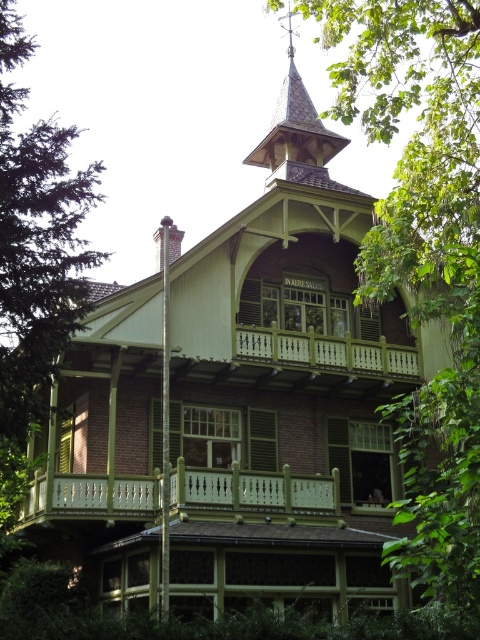
Consider the image. Between green leafy tree at upper center and green painted wood balustrade at center, which one is positioned higher?

Positioned higher is green leafy tree at upper center.

Between green leafy tree at upper center and green painted wood balustrade at center, which one appears on the right side from the viewer's perspective?

From the viewer's perspective, green leafy tree at upper center appears more on the right side.

Locate an element on the screen. Image resolution: width=480 pixels, height=640 pixels. green leafy tree at upper center is located at coordinates (424, 257).

The width and height of the screenshot is (480, 640). I want to click on green leafy tree at upper center, so click(x=424, y=257).

Is green leafy tree at upper center positioned at the back of wooden spire at upper center?

No, green leafy tree at upper center is in front of wooden spire at upper center.

Locate an element on the screen. green leafy tree at upper center is located at coordinates (424, 257).

Who is more distant from viewer, (x=412, y=99) or (x=275, y=109)?

The point (x=275, y=109) is more distant.

Image resolution: width=480 pixels, height=640 pixels. Find the location of `green leafy tree at upper center`. green leafy tree at upper center is located at coordinates (424, 257).

From the picture: Does green painted wood balustrade at center have a smaller size compared to wooden spire at upper center?

Yes.

Is green painted wood balustrade at center above wooden spire at upper center?

No.

Who is more distant from viewer, (180,490) or (276,138)?

Point (276,138)

At what (x,y) coordinates should I click in order to perform the action: click on green painted wood balustrade at center. Please return your answer as a coordinate pair (x, y). This screenshot has height=640, width=480. Looking at the image, I should click on (254, 490).